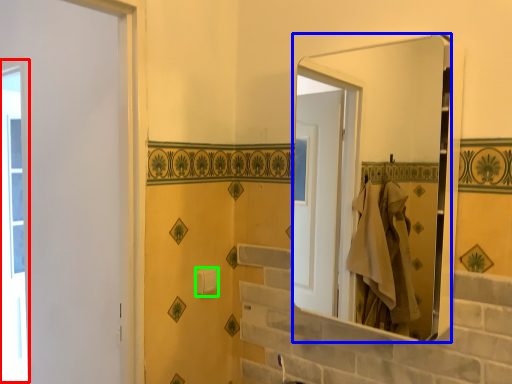
Question: Which is farther away from window (highlighted by a red box)? mirror (highlighted by a blue box) or towel bar (highlighted by a green box)?

Choices:
 (A) mirror
 (B) towel bar

Answer: (A)